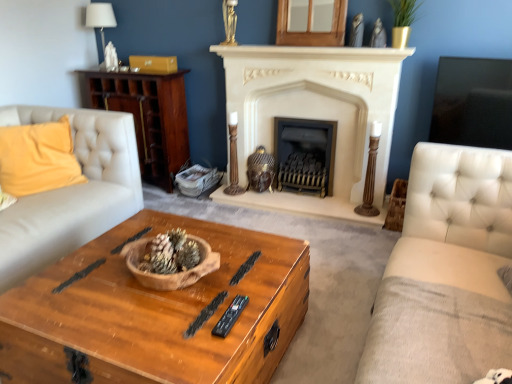
Identify the location of free region on the left part of black plastic remote at center. (184, 313).